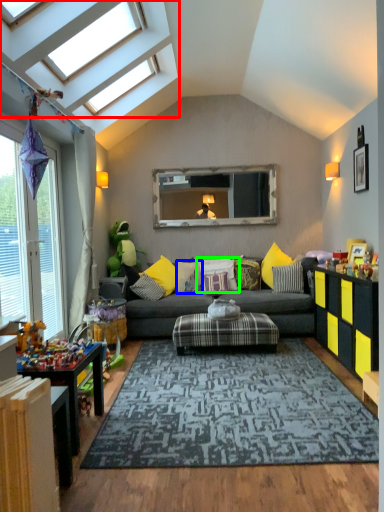
Question: Which object is the farthest from window (highlighted by a red box)? Choose among these: pillow (highlighted by a blue box) or pillow (highlighted by a green box).

Choices:
 (A) pillow
 (B) pillow

Answer: (B)